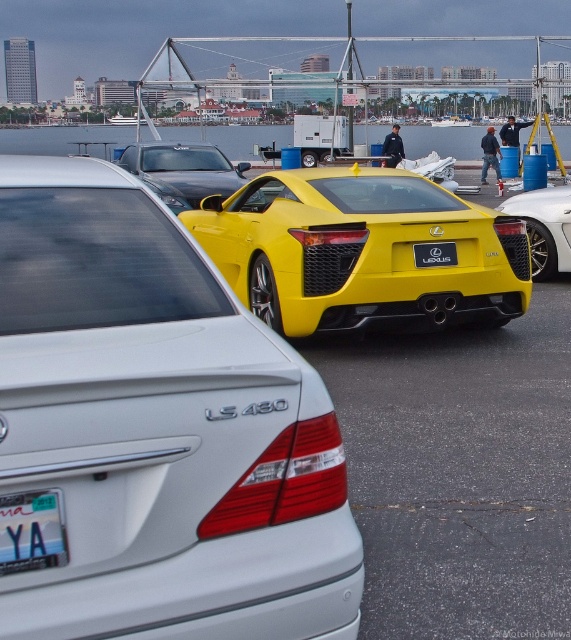
Question: Which is nearer to the white plastic license plate at lower left?

Choices:
 (A) shiny black sedan at center
 (B) yellow matte sports car at center
 (C) satin silver sedan at center
 (D) black plastic license plate at rear

Answer: (C)

Question: Where is satin silver sedan at center located in relation to shiny black sedan at center in the image?

Choices:
 (A) below
 (B) above

Answer: (A)

Question: Which point appears closest to the camera in this image?

Choices:
 (A) (27, 544)
 (B) (451, 243)
 (C) (164, 163)

Answer: (A)

Question: Is yellow matte sports car at center closer to camera compared to shiny black sedan at center?

Choices:
 (A) no
 (B) yes

Answer: (B)

Question: Can you confirm if shiny black sedan at center is positioned below white plastic license plate at lower left?

Choices:
 (A) no
 (B) yes

Answer: (A)

Question: Which point appears closest to the camera in this image?

Choices:
 (A) (199, 364)
 (B) (408, 317)
 (C) (17, 513)
 (D) (439, 253)

Answer: (C)